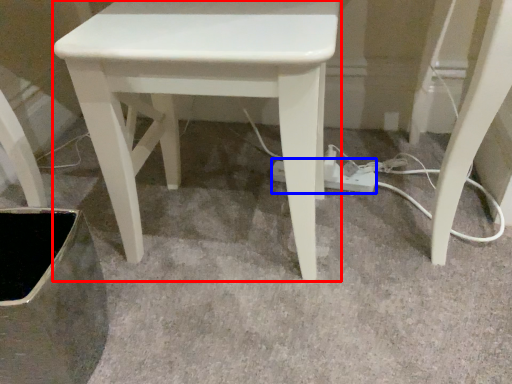
Question: Which object is closer to the camera taking this photo, stool (highlighted by a red box) or extension cord (highlighted by a blue box)?

Choices:
 (A) stool
 (B) extension cord

Answer: (A)